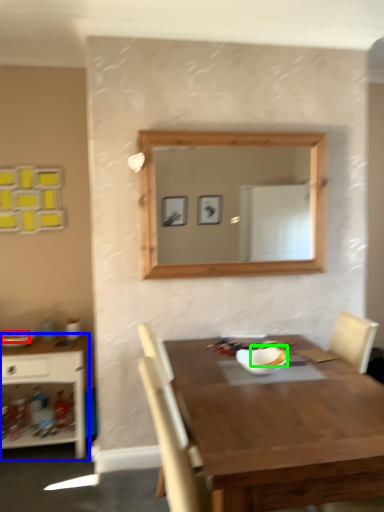
Question: Which object is the closest to the food (highlighted by a red box)? Choose among these: shelf (highlighted by a blue box) or food (highlighted by a green box).

Choices:
 (A) shelf
 (B) food

Answer: (A)